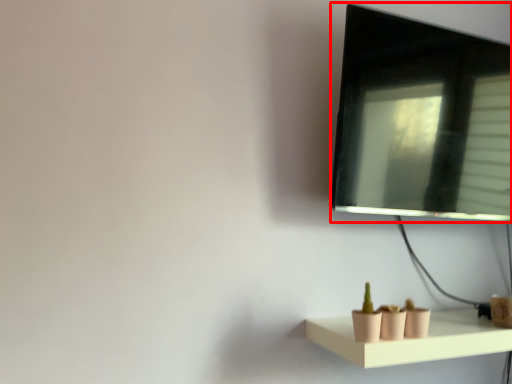
Question: From the image's perspective, what is the correct spatial relationship of computer monitor (annotated by the red box) in relation to shelf?

Choices:
 (A) below
 (B) above

Answer: (B)